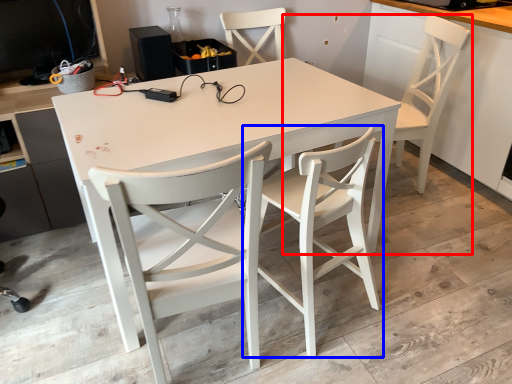
Question: Which object is closer to the camera taking this photo, chair (highlighted by a red box) or chair (highlighted by a blue box)?

Choices:
 (A) chair
 (B) chair

Answer: (B)